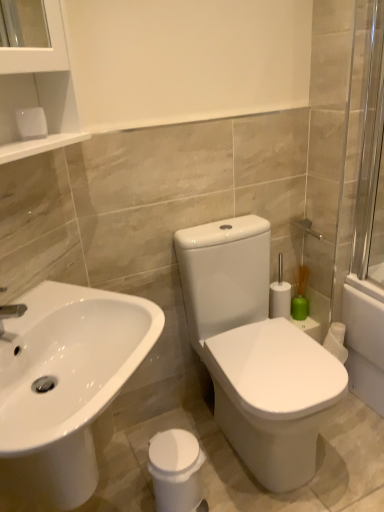
The width and height of the screenshot is (384, 512). I want to click on transparent glass screen door at right, so click(x=370, y=147).

This screenshot has height=512, width=384. What do you see at coordinates (176, 470) in the screenshot?
I see `white glossy trash can at lower center` at bounding box center [176, 470].

Locate an element on the screen. Image resolution: width=384 pixels, height=512 pixels. white glossy trash can at lower center is located at coordinates (176, 470).

The image size is (384, 512). What do you see at coordinates (300, 296) in the screenshot?
I see `green matte vase at right` at bounding box center [300, 296].

Where is `white glossy sink at lower left`? white glossy sink at lower left is located at coordinates (66, 385).

Is green matte vase at right at the right side of white glossy trash can at lower center?

Yes, green matte vase at right is to the right of white glossy trash can at lower center.

From the image's perspective, which one is positioned lower, green matte vase at right or white glossy trash can at lower center?

From the image's view, white glossy trash can at lower center is below.

Between green matte vase at right and white glossy trash can at lower center, which one is positioned behind?

green matte vase at right is more distant.

Which of these two, green matte vase at right or white glossy trash can at lower center, is bigger?

With larger size is white glossy trash can at lower center.

Is point (358, 249) positioned before point (302, 316)?

That is True.

Do you think transparent glass screen door at right is within green matte vase at right, or outside of it?

transparent glass screen door at right is not enclosed by green matte vase at right.

Is transparent glass screen door at right oriented towards green matte vase at right?

No, transparent glass screen door at right does not turn towards green matte vase at right.

Which object is wider, silver metallic tap at left or white glossy sink at lower left?

white glossy sink at lower left.

From the image's perspective, which is below, silver metallic tap at left or white glossy sink at lower left?

white glossy sink at lower left is shown below in the image.

Is white glossy sink at lower left at the back of silver metallic tap at left?

silver metallic tap at left is not turned away from white glossy sink at lower left.

Is silver metallic tap at left facing towards white glossy trash can at lower center?

No, silver metallic tap at left does not turn towards white glossy trash can at lower center.

Consider the image. Which is less distant, (1, 319) or (149, 447)?

The point (1, 319) is more forward.

Is silver metallic tap at left taller than white glossy trash can at lower center?

In fact, silver metallic tap at left may be shorter than white glossy trash can at lower center.

In the image, is silver metallic tap at left positioned in front of or behind white glossy trash can at lower center?

In the image, silver metallic tap at left appears in front of white glossy trash can at lower center.

Considering the sizes of objects white glossy trash can at lower center and transparent glass screen door at right in the image provided, who is shorter, white glossy trash can at lower center or transparent glass screen door at right?

Standing shorter between the two is white glossy trash can at lower center.

Between white glossy trash can at lower center and transparent glass screen door at right, which one appears on the left side from the viewer's perspective?

white glossy trash can at lower center is more to the left.

From the image's perspective, is white glossy trash can at lower center above or below transparent glass screen door at right?

white glossy trash can at lower center is situated lower than transparent glass screen door at right in the image.

Does point (160, 444) come behind point (378, 95)?

No.

Which of these two, green matte vase at right or silver metallic tap at left, is wider?

silver metallic tap at left is wider.

Is green matte vase at right positioned beyond the bounds of silver metallic tap at left?

green matte vase at right lies outside silver metallic tap at left's area.

From a real-world perspective, is green matte vase at right on silver metallic tap at left?

No, from a real-world perspective, green matte vase at right is not over silver metallic tap at left

Is green matte vase at right facing away from silver metallic tap at left?

That's not correct — green matte vase at right is not looking away from silver metallic tap at left.

Does green matte vase at right have a larger size compared to white glossy sink at lower left?

No, green matte vase at right is not bigger than white glossy sink at lower left.

Based on the photo, how distant is green matte vase at right from white glossy sink at lower left?

green matte vase at right and white glossy sink at lower left are 1.08 meters apart from each other.

Is green matte vase at right not near white glossy sink at lower left?

That's right, there is a large distance between green matte vase at right and white glossy sink at lower left.

Which is nearer, [301,279] or [51,281]?

Point [301,279].

This screenshot has height=512, width=384. Find the location of `soap dispenser located above the white glossy trash can at lower center (from a real-world perspective)`. soap dispenser located above the white glossy trash can at lower center (from a real-world perspective) is located at coordinates (300, 296).

The height and width of the screenshot is (512, 384). Find the location of `soap dispenser lying below the transparent glass screen door at right (from the image's perspective)`. soap dispenser lying below the transparent glass screen door at right (from the image's perspective) is located at coordinates (300, 296).

Based on their spatial positions, is silver metallic tap at left or green matte vase at right further from white glossy trash can at lower center?

Among the two, green matte vase at right is located further to white glossy trash can at lower center.

Based on their spatial positions, is silver metallic tap at left or transparent glass screen door at right closer to white glossy sink at lower left?

silver metallic tap at left.

Looking at the image, which one is located closer to white glossy trash can at lower center, white glossy sink at lower left or transparent glass screen door at right?

white glossy sink at lower left is positioned closer to the anchor white glossy trash can at lower center.

Looking at the image, which one is located closer to white glossy sink at lower left, green matte vase at right or white glossy trash can at lower center?

white glossy trash can at lower center.

When comparing their distances from green matte vase at right, does silver metallic tap at left or transparent glass screen door at right seem closer?

transparent glass screen door at right.

Estimate the real-world distances between objects in this image. Which object is closer to green matte vase at right, silver metallic tap at left or white glossy trash can at lower center?

The object closer to green matte vase at right is white glossy trash can at lower center.

From the picture: When comparing their distances from silver metallic tap at left, does transparent glass screen door at right or white glossy sink at lower left seem further?

transparent glass screen door at right lies further to silver metallic tap at left than the other object.

Considering their positions, is white glossy trash can at lower center positioned further to transparent glass screen door at right than green matte vase at right?

white glossy trash can at lower center lies further to transparent glass screen door at right than the other object.

Find the location of `sink that lies between transparent glass screen door at right and white glossy trash can at lower center from top to bottom`. sink that lies between transparent glass screen door at right and white glossy trash can at lower center from top to bottom is located at coordinates (66, 385).

Find the location of `porcelain situated between silver metallic tap at left and green matte vase at right from left to right`. porcelain situated between silver metallic tap at left and green matte vase at right from left to right is located at coordinates (176, 470).

Image resolution: width=384 pixels, height=512 pixels. I want to click on porcelain positioned between white glossy sink at lower left and green matte vase at right from near to far, so [176, 470].

This screenshot has width=384, height=512. I want to click on tap between white glossy sink at lower left and green matte vase at right along the z-axis, so click(x=10, y=313).